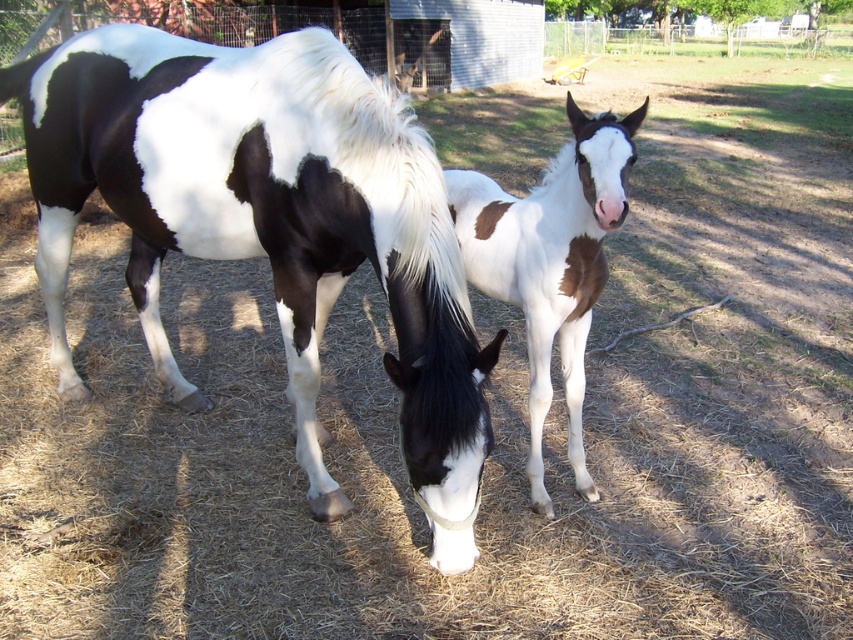
Question: From the image, what is the correct spatial relationship of black and white speckled horse at center in relation to white glossy horse at center?

Choices:
 (A) below
 (B) above

Answer: (B)

Question: Is black and white speckled horse at center below white glossy horse at center?

Choices:
 (A) yes
 (B) no

Answer: (B)

Question: Among these points, which one is farthest from the camera?

Choices:
 (A) (573, 122)
 (B) (309, 134)

Answer: (B)

Question: Where is black and white speckled horse at center located in relation to white glossy horse at center in the image?

Choices:
 (A) above
 (B) below

Answer: (A)